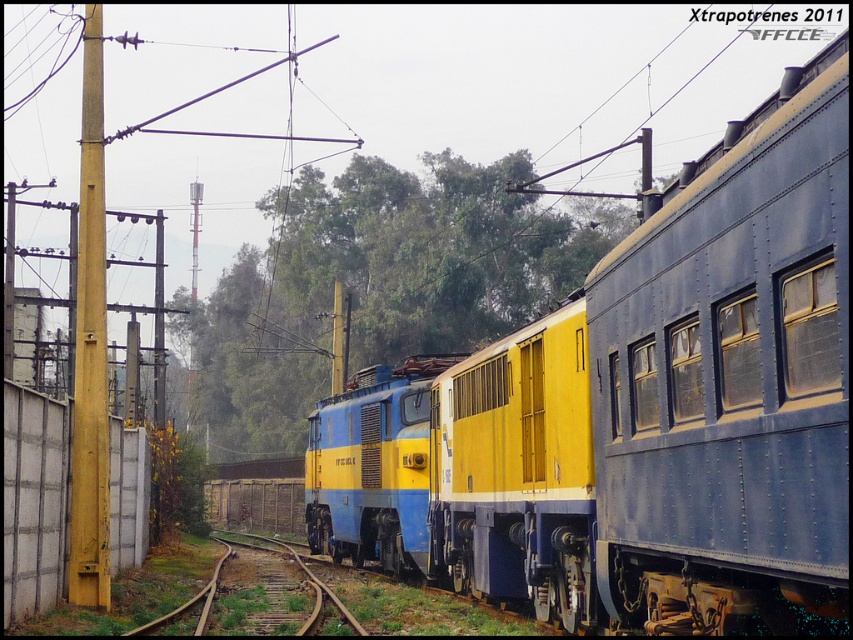
Between point (751, 317) and point (361, 221), which one is positioned behind?

Positioned behind is point (361, 221).

Does blue/yellow painted locomotive at center have a lesser width compared to green leafy tree at center?

Indeed, blue/yellow painted locomotive at center has a lesser width compared to green leafy tree at center.

Locate an element on the screen. The width and height of the screenshot is (853, 640). blue/yellow painted locomotive at center is located at coordinates (648, 406).

Does yellow painted metal pole at left lie in front of brown wooden train track at center?

No, yellow painted metal pole at left is further to the viewer.

Locate an element on the screen. yellow painted metal pole at left is located at coordinates (90, 346).

Is point (86, 324) more distant than point (262, 536)?

No.

Find the location of `yellow painted metal pole at left`. yellow painted metal pole at left is located at coordinates (90, 346).

Does green leafy tree at center appear under brown wooden train track at center?

No, green leafy tree at center is not below brown wooden train track at center.

Does point (325, 326) come closer to viewer compared to point (341, 605)?

No, (325, 326) is further to viewer.

Where is `green leafy tree at center`? green leafy tree at center is located at coordinates (379, 284).